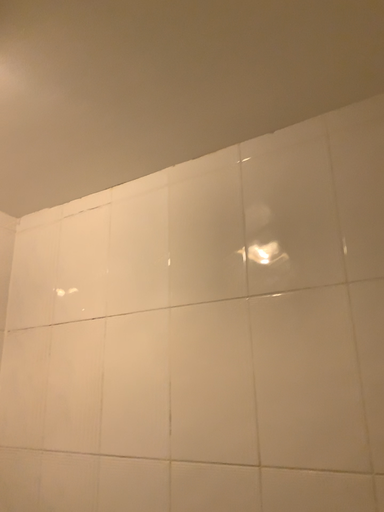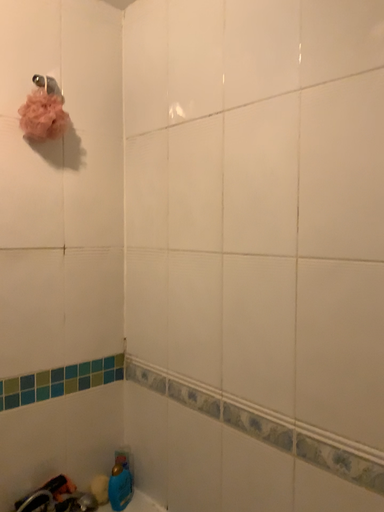
Question: How did the camera likely rotate when shooting the video?

Choices:
 (A) rotated upward
 (B) rotated downward

Answer: (B)